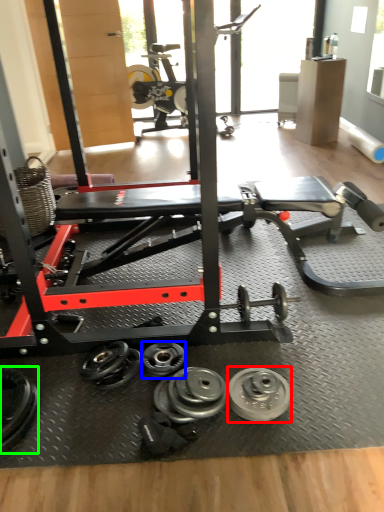
Question: Based on their relative distances, which object is farther from wheel (highlighted by a red box)? Choose from dumbbell (highlighted by a blue box) and dumbbell (highlighted by a green box).

Choices:
 (A) dumbbell
 (B) dumbbell

Answer: (B)